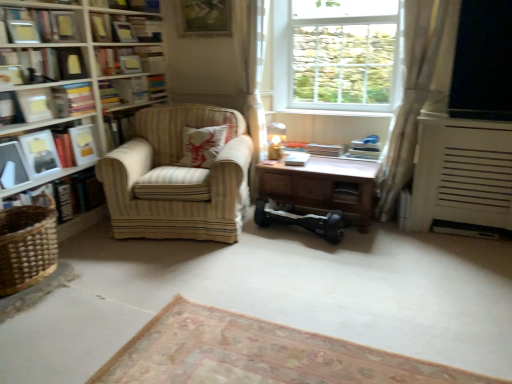
This screenshot has height=384, width=512. Identify the location of free spot below carpeted floor at lower center, arranged as the first plain when viewed from the back (from a real-world perspective). (242, 352).